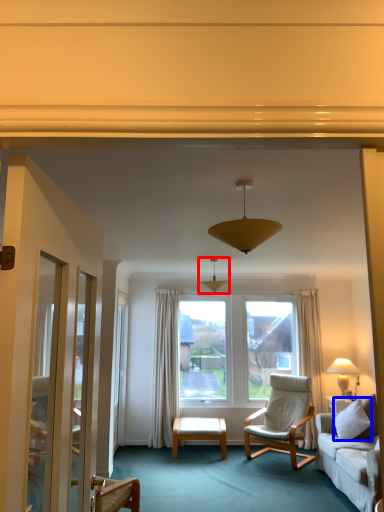
Question: Which object is closer to the camera taking this photo, lamp (highlighted by a red box) or pillow (highlighted by a blue box)?

Choices:
 (A) lamp
 (B) pillow

Answer: (B)